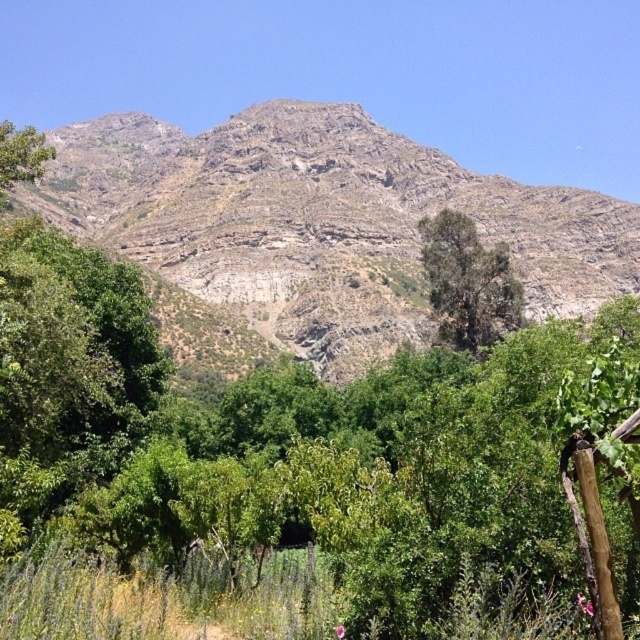
Between point (365, 364) and point (483, 301), which one is positioned in front?

Point (483, 301) is more forward.

Looking at this image, is rocky gray mountain at upper center below green leafy tree at center?

Actually, rocky gray mountain at upper center is above green leafy tree at center.

Between point (488, 230) and point (445, 211), which one is positioned in front?

Positioned in front is point (445, 211).

Locate an element on the screen. rocky gray mountain at upper center is located at coordinates (316, 228).

Is rocky gray mountain at upper center to the right of green leafy tree at left from the viewer's perspective?

In fact, rocky gray mountain at upper center is to the left of green leafy tree at left.

Based on the photo, measure the distance between rocky gray mountain at upper center and camera.

rocky gray mountain at upper center and camera are 386.68 feet apart.

Identify the location of rocky gray mountain at upper center. Image resolution: width=640 pixels, height=640 pixels. click(x=316, y=228).

Consider the image. Between green leafy tree at center and green leafy tree at left, which one has less height?

With less height is green leafy tree at left.

The width and height of the screenshot is (640, 640). Describe the element at coordinates (468, 282) in the screenshot. I see `green leafy tree at center` at that location.

Between point (460, 272) and point (51, 156), which one is positioned in front?

Positioned in front is point (51, 156).

Where is `green leafy tree at center`? This screenshot has height=640, width=640. green leafy tree at center is located at coordinates (468, 282).